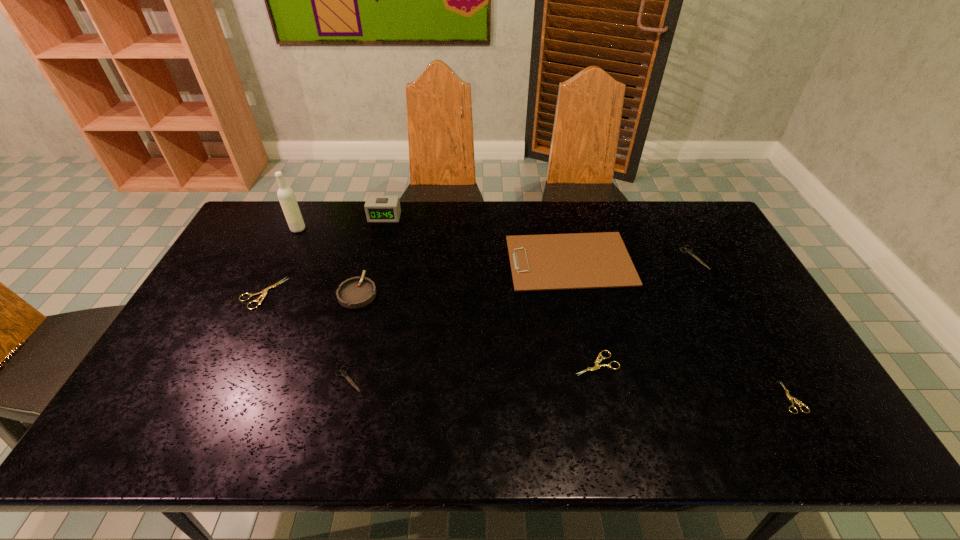
This screenshot has width=960, height=540. What are the coordinates of `free region located 0.100m on the right of the gray ashtray` in the screenshot? It's located at (410, 292).

At what (x,y) coordinates should I click in order to perform the action: click on vacant point located 0.180m on the front of the clipboard. Please return your answer as a coordinate pair (x, y). Image resolution: width=960 pixels, height=540 pixels. Looking at the image, I should click on (588, 339).

At what (x,y) coordinates should I click in order to perform the action: click on free space located on the front of the farther black shears. Please return your answer as a coordinate pair (x, y). This screenshot has height=540, width=960. Looking at the image, I should click on (750, 364).

Where is `free location located on the right of the farthest beige shears`? This screenshot has height=540, width=960. free location located on the right of the farthest beige shears is located at coordinates (310, 293).

I want to click on vacant space situated 0.110m on the right of the second biggest beige shears, so point(661,363).

Locate an element on the screen. vacant space located 0.220m on the left of the smaller black shears is located at coordinates (247, 379).

Where is `free space located 0.260m on the left of the rightmost shears`? This screenshot has width=960, height=540. free space located 0.260m on the left of the rightmost shears is located at coordinates (675, 397).

Image resolution: width=960 pixels, height=540 pixels. Identify the location of vodka situated at the far edge. (286, 196).

In order to click on alarm clock present at the far edge in this screenshot , I will do `click(377, 208)`.

Locate an element on the screen. clipboard located at the far edge is located at coordinates [x=580, y=260].